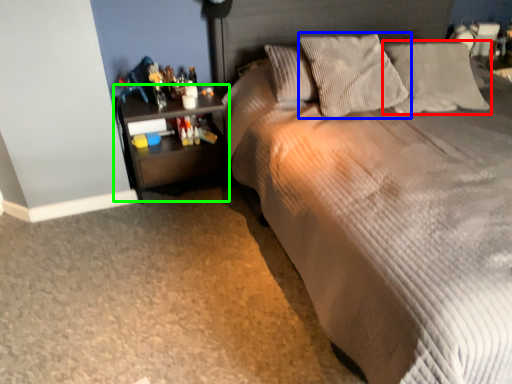
Question: Which object is the farthest from pillow (highlighted by a red box)? Choose among these: pillow (highlighted by a blue box) or nightstand (highlighted by a green box).

Choices:
 (A) pillow
 (B) nightstand

Answer: (B)